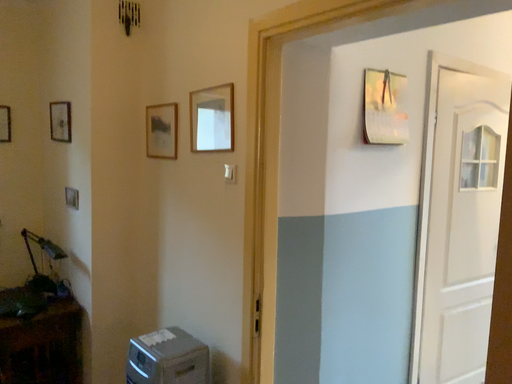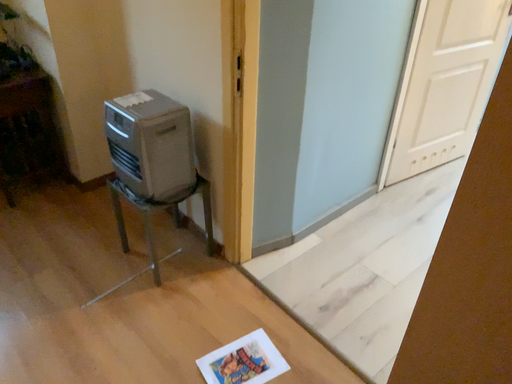
Question: Which way did the camera rotate in the video?

Choices:
 (A) rotated downward
 (B) rotated upward

Answer: (A)